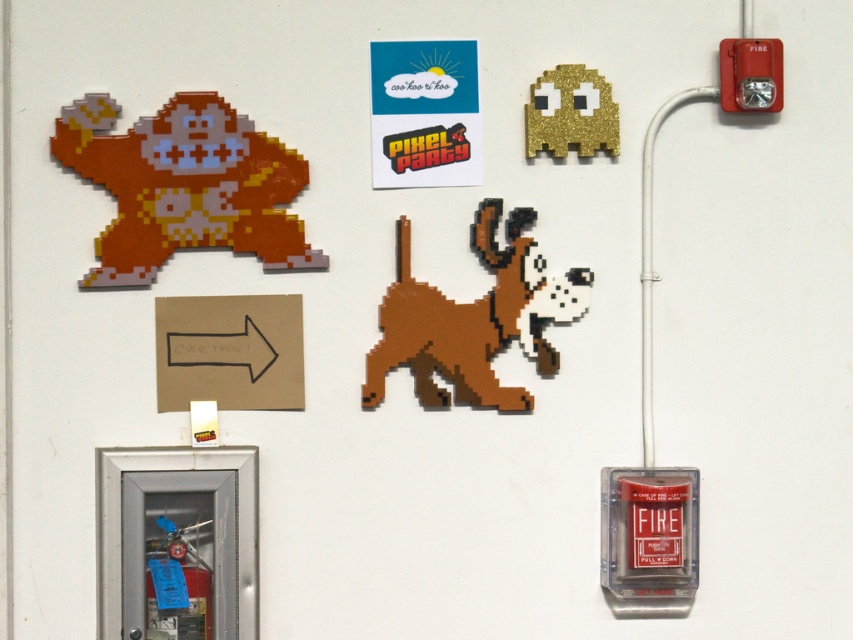
You are an interior designer assessing wall decorations. You notice the matte orange pixelated monkey at upper left and the gold glitter ghost at upper center. Which of these two objects is positioned lower on the wall?

The matte orange pixelated monkey at upper left is positioned lower on the wall than the gold glitter ghost at upper center.

You are an interior designer assessing wall decorations. You notice the matte orange pixelated monkey at upper left and the gold glitter ghost at upper center. Which of these two objects has a greater horizontal width?

The matte orange pixelated monkey at upper left might be wider than gold glitter ghost at upper center according to the description provided.

You are an interior designer planning to hang a new painting on this wall. There are already several items on the wall, including the metallic fire extinguisher cabinet with a blue tag hanging from its handle and the brown cardboard arrow pointing to the right. You notice a point marked at coordinates (x=184, y=186). What object is located at that point?

The point at coordinates (x=184, y=186) indicates a matte orange pixelated monkey at upper left.